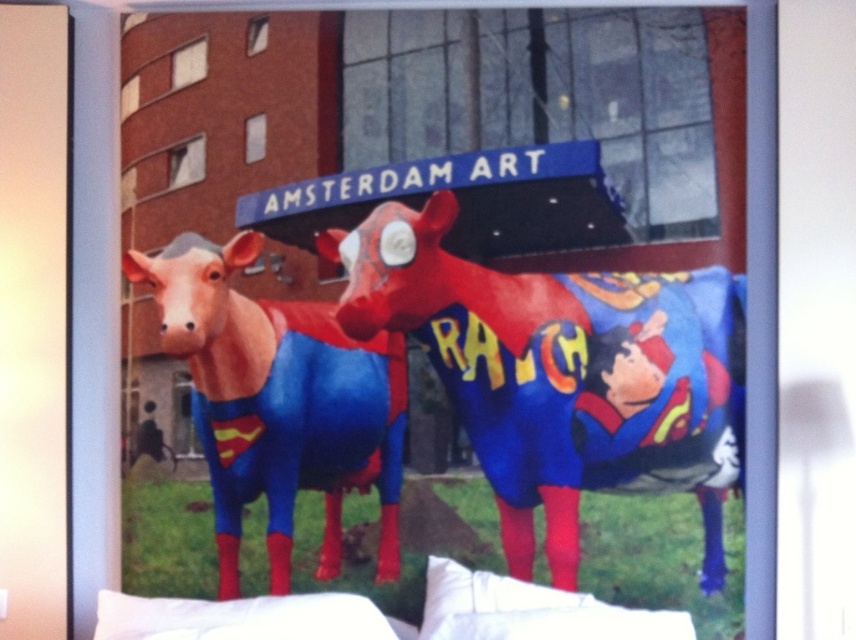
Measure the distance from white fabric pillow at lower center to white soft pillow at lower center.

The distance of white fabric pillow at lower center from white soft pillow at lower center is 36.76 centimeters.

The height and width of the screenshot is (640, 856). In order to click on white fabric pillow at lower center in this screenshot , I will do `click(530, 611)`.

Locate an element on the screen. Image resolution: width=856 pixels, height=640 pixels. white fabric pillow at lower center is located at coordinates (530, 611).

Is point (405, 218) farther from camera compared to point (388, 493)?

Yes, point (405, 218) is farther from viewer.

Does matte plastic cow at center have a greater height compared to matte plastic bull at center?

Indeed, matte plastic cow at center has a greater height compared to matte plastic bull at center.

Identify the location of matte plastic cow at center. The height and width of the screenshot is (640, 856). (562, 374).

This screenshot has height=640, width=856. I want to click on matte plastic cow at center, so click(x=562, y=374).

Is matte plastic bull at center positioned in front of white soft pillow at lower center?

That is False.

The width and height of the screenshot is (856, 640). I want to click on matte plastic bull at center, so click(278, 403).

Does point (385, 336) lie behind point (325, 593)?

Yes, it is behind point (325, 593).

Find the location of a particular element. matte plastic bull at center is located at coordinates (278, 403).